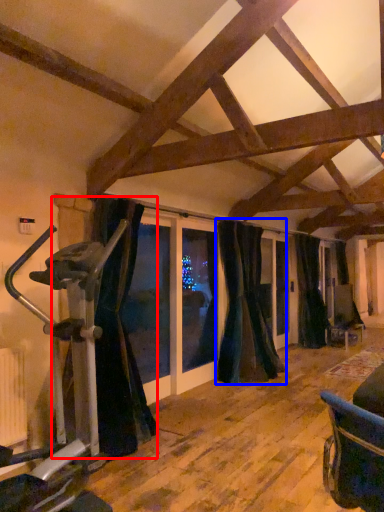
Question: Which object is further to the camera taking this photo, curtain (highlighted by a red box) or curtain (highlighted by a blue box)?

Choices:
 (A) curtain
 (B) curtain

Answer: (B)